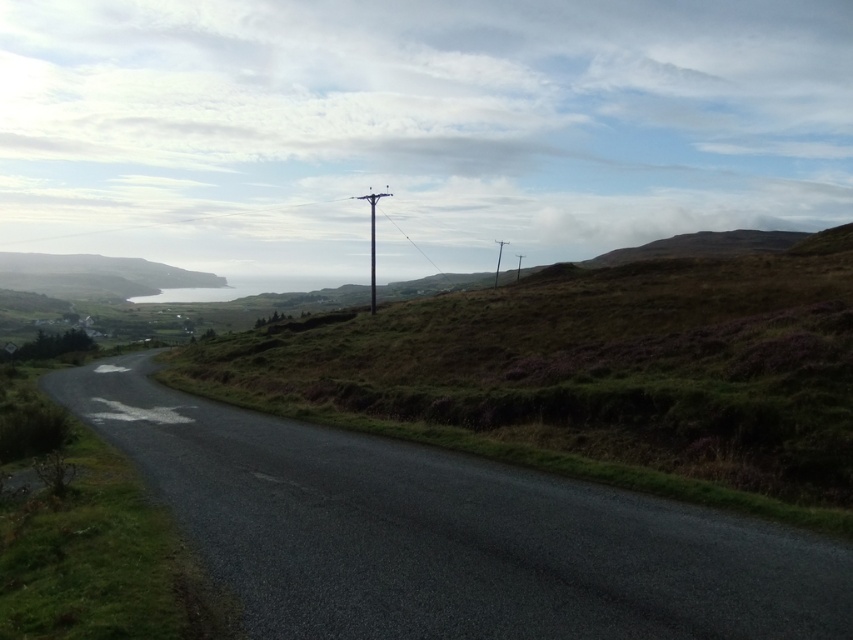
Question: Is green grassy hillside at center thinner than smooth gray pole at center?

Choices:
 (A) yes
 (B) no

Answer: (B)

Question: Which point appears farthest from the camera in this image?

Choices:
 (A) (612, 598)
 (B) (28, 556)
 (C) (440, 269)
 (D) (517, 273)

Answer: (C)

Question: Is green grassy hillside at center below smooth gray pole at center?

Choices:
 (A) no
 (B) yes

Answer: (B)

Question: Which point is closer to the camera?

Choices:
 (A) brown wooden telegraph pole at center
 (B) metallic wire at upper center
 (C) dark asphalt road at center
 (D) green grassy hillside at center

Answer: (C)

Question: Which object is the closest to the metallic wire at upper center?

Choices:
 (A) green grassy at left
 (B) smooth gray pole at center
 (C) black plastic power line at center
 (D) brown wooden telegraph pole at center

Answer: (C)

Question: Does black plastic power line at center have a lesser width compared to brown wooden telegraph pole at center?

Choices:
 (A) no
 (B) yes

Answer: (A)